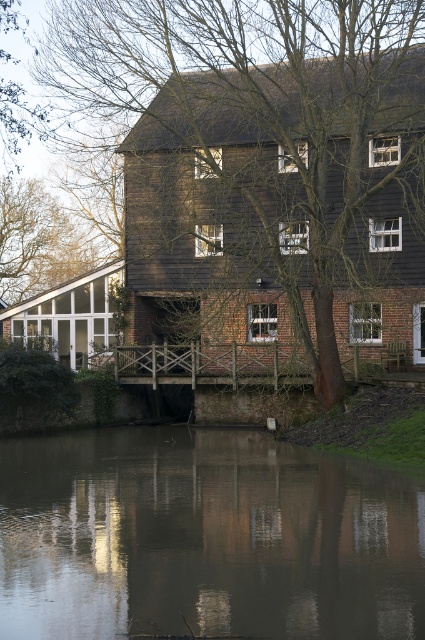
Question: Is murky reflective water at center positioned behind brown wood tree at center?

Choices:
 (A) no
 (B) yes

Answer: (A)

Question: Does murky reflective water at center have a lesser width compared to brown wood tree at center?

Choices:
 (A) yes
 (B) no

Answer: (A)

Question: Which object appears closest to the camera in this image?

Choices:
 (A) murky reflective water at center
 (B) brown wood tree at center

Answer: (A)

Question: Which of the following is the closest to the observer?

Choices:
 (A) brown wood tree at center
 (B) murky reflective water at center

Answer: (B)

Question: Which point appears farthest from the camera in this image?

Choices:
 (A) (104, 588)
 (B) (183, 163)

Answer: (B)

Question: Does murky reflective water at center come in front of brown wood tree at center?

Choices:
 (A) yes
 (B) no

Answer: (A)